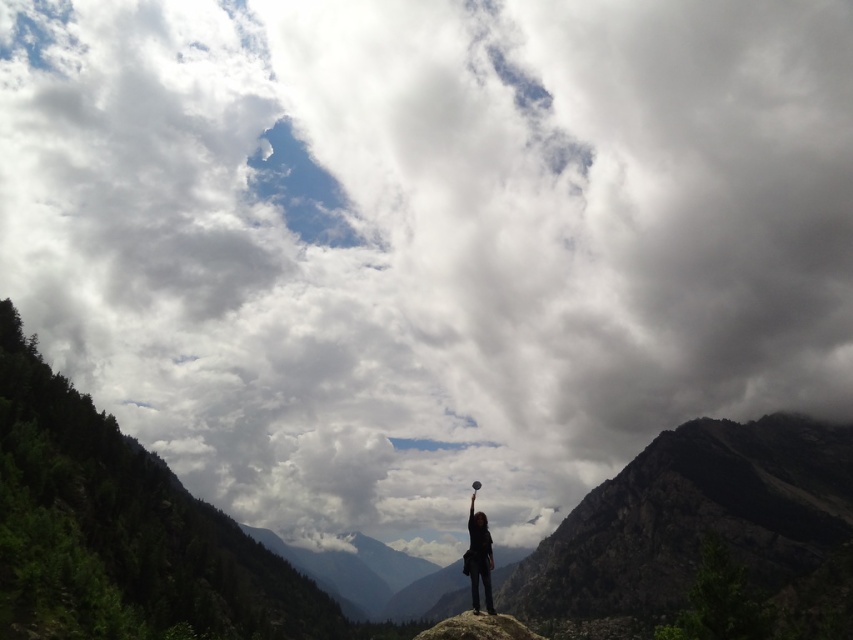
Question: Does gray rock at center appear under black fabric person at center?

Choices:
 (A) no
 (B) yes

Answer: (B)

Question: Estimate the real-world distances between objects in this image. Which object is closer to the gray rock at center?

Choices:
 (A) black fabric person at center
 (B) rugged stone mountain at center

Answer: (A)

Question: Estimate the real-world distances between objects in this image. Which object is closer to the rugged stone mountain at center?

Choices:
 (A) black fabric person at center
 (B) gray rock at center

Answer: (B)

Question: Does gray rock at center lie in front of black fabric person at center?

Choices:
 (A) no
 (B) yes

Answer: (B)

Question: Which point is closer to the camera taking this photo?

Choices:
 (A) (488, 625)
 (B) (474, 612)

Answer: (A)

Question: Does rugged stone mountain at center come in front of gray rock at center?

Choices:
 (A) no
 (B) yes

Answer: (A)